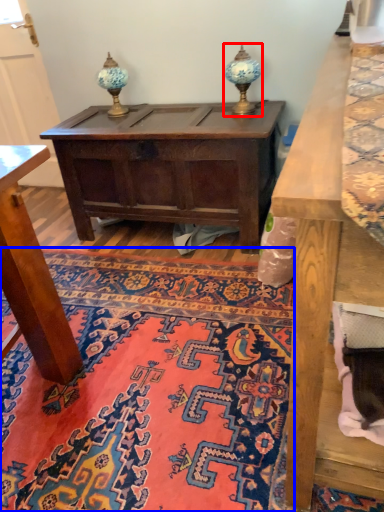
Question: Which object is further to the camera taking this photo, table lamp (highlighted by a red box) or mat (highlighted by a blue box)?

Choices:
 (A) table lamp
 (B) mat

Answer: (A)